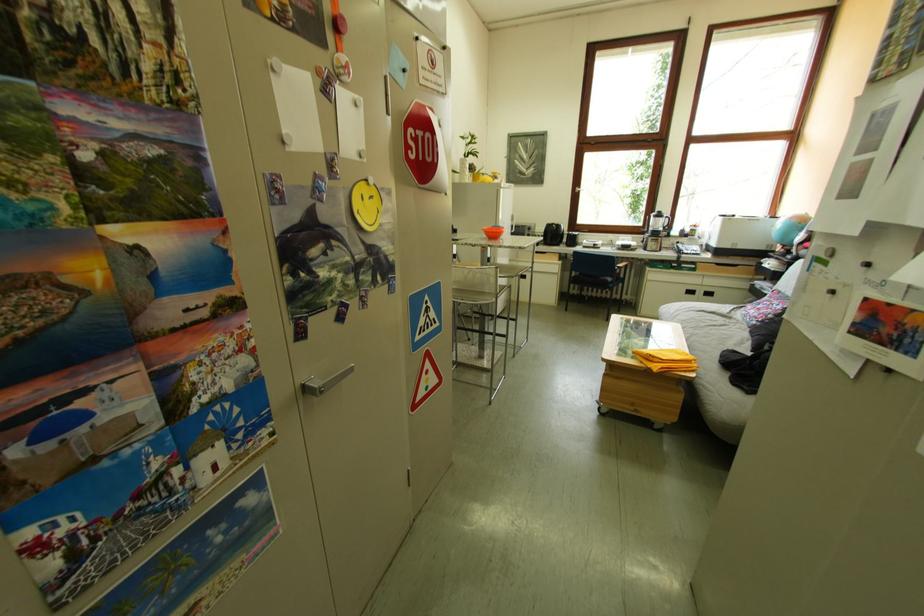
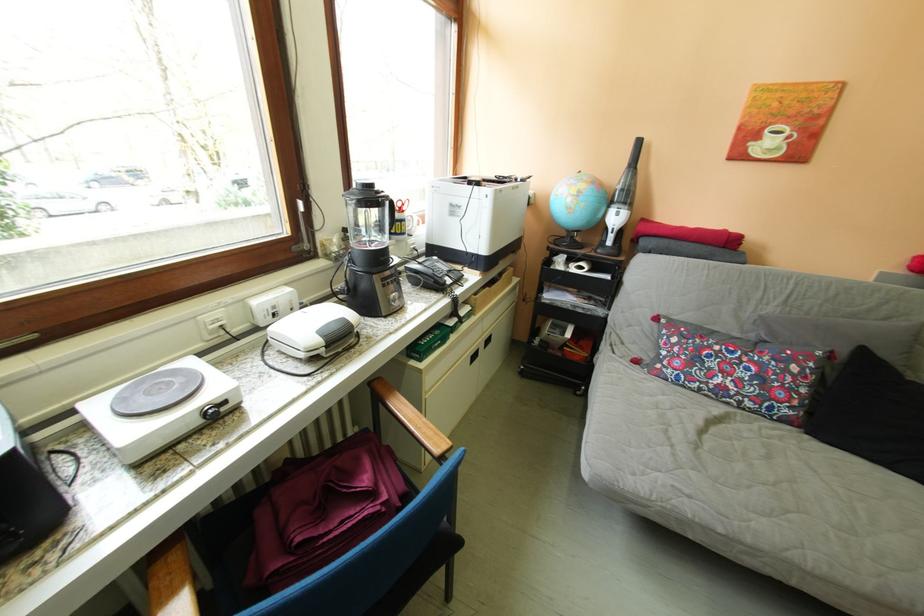
Find the pixel in the second image that matches point (808, 256) in the first image.

(622, 246)